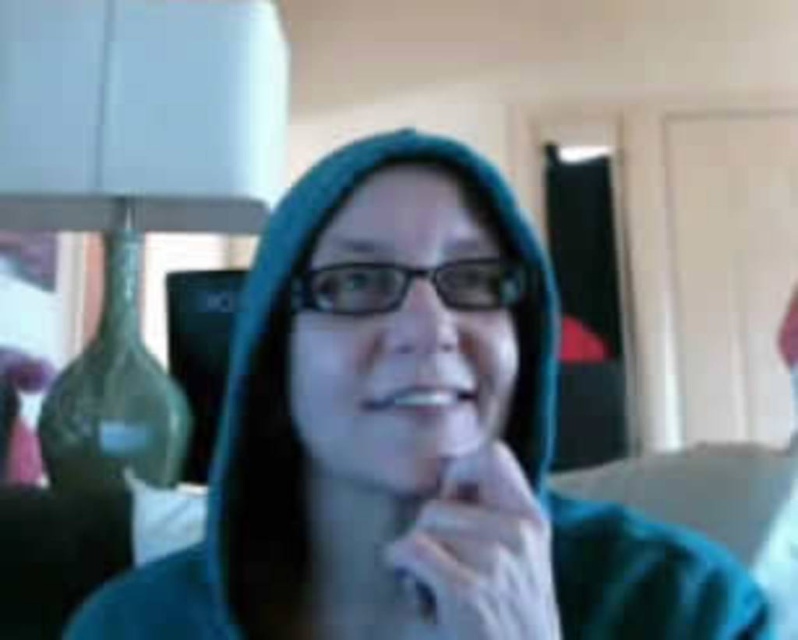
Based on the scene description, which object is wider, the white fabric hand at center or the white glossy teeth at center?

The white fabric hand at center is wider than the white glossy teeth at center according to the description.

You are an artist trying to sketch the scene. The white fabric hand at center is at point 0.863, 0.605 on the canvas. If you want to draw the hand in the exact center of the canvas, should you move it to the left or right?

The white fabric hand at center is currently at coordinates (482, 552). Since the exact center of the canvas is at (399, 320), the hand is positioned to the right and above the center. To move it to the exact center, you should move it to the left and down.

You are a photographer adjusting the lighting in the room. You need to ensure that the white fabric hand at center and the white glossy teeth at center are both visible in the photo. Which object should you focus on first to make sure it is properly lit?

The white fabric hand at center is in front of the white glossy teeth at center, so you should focus on lighting the white fabric hand at center first to ensure it doesn not block the light from reaching the teeth and make them visible.